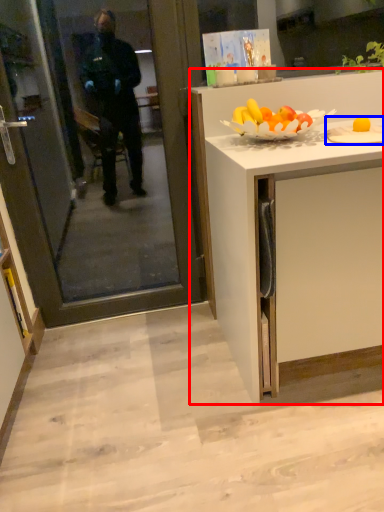
Question: Which object is closer to the camera taking this photo, cabinetry (highlighted by a red box) or plate (highlighted by a blue box)?

Choices:
 (A) cabinetry
 (B) plate

Answer: (A)